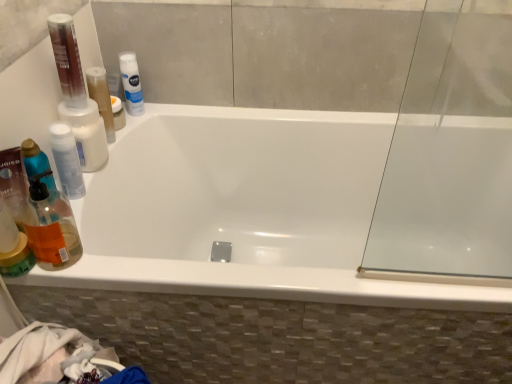
Question: Is the depth of translucent orange liquid at left less than that of white glossy bathtub at center?

Choices:
 (A) yes
 (B) no

Answer: (A)

Question: Is the depth of translucent orange liquid at left greater than that of white glossy bathtub at center?

Choices:
 (A) no
 (B) yes

Answer: (A)

Question: From the image's perspective, is translucent orange liquid at left located above white glossy bathtub at center?

Choices:
 (A) no
 (B) yes

Answer: (B)

Question: From the image's perspective, is translucent orange liquid at left beneath white glossy bathtub at center?

Choices:
 (A) no
 (B) yes

Answer: (A)

Question: Is translucent orange liquid at left far from white glossy bathtub at center?

Choices:
 (A) no
 (B) yes

Answer: (A)

Question: Would you say translucent orange liquid at left is to the left or to the right of white opaque bottle at upper left, which is counted as the second mouthwash, starting from the back, in the picture?

Choices:
 (A) left
 (B) right

Answer: (B)

Question: From a real-world perspective, is translucent orange liquid at left above or below white opaque bottle at upper left, which appears as the second mouthwash when viewed from the front?

Choices:
 (A) below
 (B) above

Answer: (A)

Question: From the image's perspective, is translucent orange liquid at left positioned above or below white opaque bottle at upper left, which is counted as the second mouthwash, starting from the back?

Choices:
 (A) below
 (B) above

Answer: (A)

Question: Looking at the image, does translucent orange liquid at left seem bigger or smaller compared to white opaque bottle at upper left, which appears as the second mouthwash when viewed from the front?

Choices:
 (A) small
 (B) big

Answer: (A)

Question: Is transparent plastic bottle at left, the first mouthwash in the front-to-back sequence, taller or shorter than white glossy bathtub at center?

Choices:
 (A) short
 (B) tall

Answer: (A)

Question: From the image's perspective, relative to white glossy bathtub at center, is transparent plastic bottle at left, the first mouthwash in the front-to-back sequence, above or below?

Choices:
 (A) above
 (B) below

Answer: (A)

Question: Considering their positions, is transparent plastic bottle at left, the first mouthwash in the front-to-back sequence, located in front of or behind white glossy bathtub at center?

Choices:
 (A) behind
 (B) front

Answer: (A)

Question: Does point (56, 130) appear closer or farther from the camera than point (282, 292)?

Choices:
 (A) farther
 (B) closer

Answer: (A)

Question: From a real-world perspective, is white matte nivea spray at upper center, acting as the 1th mouthwash starting from the back, physically located above or below white opaque bottle at upper left, which appears as the second mouthwash when viewed from the front?

Choices:
 (A) below
 (B) above

Answer: (B)

Question: Considering the positions of white matte nivea spray at upper center, acting as the 1th mouthwash starting from the back, and white opaque bottle at upper left, which is counted as the second mouthwash, starting from the back, in the image, is white matte nivea spray at upper center, acting as the 1th mouthwash starting from the back, bigger or smaller than white opaque bottle at upper left, which is counted as the second mouthwash, starting from the back,?

Choices:
 (A) big
 (B) small

Answer: (B)